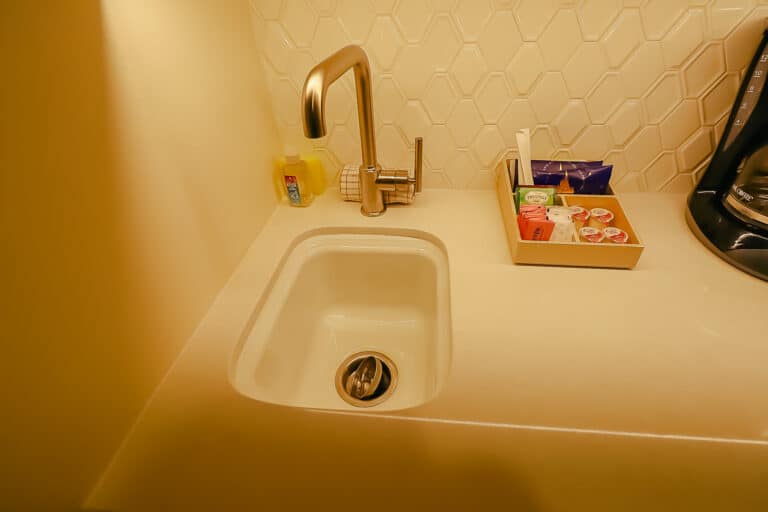
This screenshot has width=768, height=512. I want to click on drain, so click(355, 375).